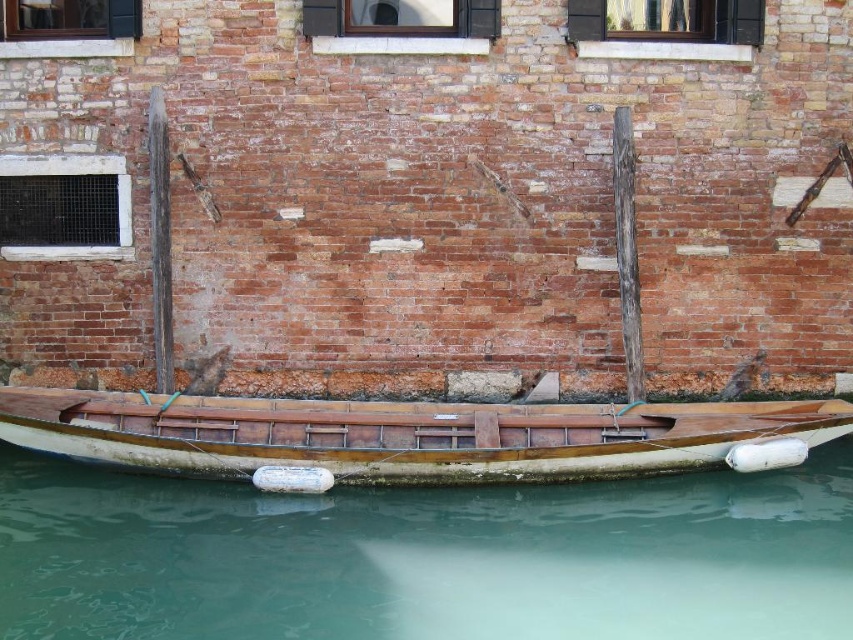
You are standing on the dock looking at the wooden boat at lower center and the clear water at lower center. Which object is nearer to you?

The clear water at lower center is closer to you than the wooden boat at lower center.

You are a tour guide explaining the canal to visitors. You mention the wooden boat at lower center and the clear water at lower center. How far apart are they in feet?

The distance between the clear water at lower center and the wooden boat at lower center is 38.37 inches, which is approximately 3.1975 feet. So, they are about 3.2 feet apart.